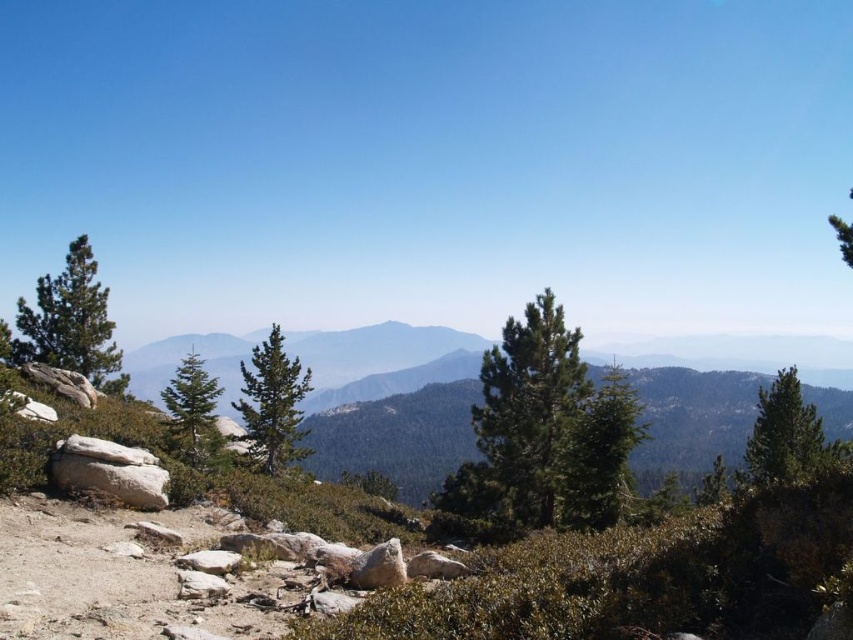
Does green needle-like at center have a greater width compared to green textured tree at upper right?

No, green needle-like at center is not wider than green textured tree at upper right.

Is point (569, 356) closer to camera compared to point (840, 241)?

That is False.

Which is behind, point (544, 365) or point (851, 259)?

Point (544, 365)

You are a GUI agent. You are given a task and a screenshot of the screen. Output one action in this format:
    pyautogui.click(x=<x>, y=<y>)
    Task: Click on the green needle-like at center
    The image size is (853, 640).
    Given the screenshot: What is the action you would take?
    point(543,432)

Looking at this image, does green needle-like at center appear under green matte tree at left?

Yes.

Between green needle-like at center and green matte tree at left, which one is positioned lower?

Positioned lower is green needle-like at center.

Locate an element on the screen. green needle-like at center is located at coordinates (543, 432).

Looking at this image, which is below, green textured tree at right or green textured tree at upper right?

green textured tree at right is lower down.

Does green textured tree at right come in front of green textured tree at upper right?

Yes, green textured tree at right is closer to the viewer.

Who is more forward, (751,445) or (845,248)?

Point (845,248)

The image size is (853, 640). Find the location of `green textured tree at right`. green textured tree at right is located at coordinates (782, 433).